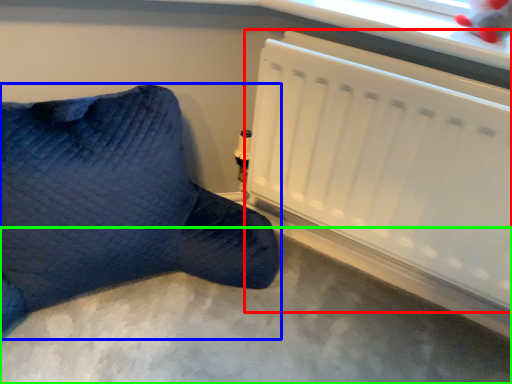
Question: Considering the real-world distances, which object is farthest from radiator (highlighted by a red box)? furniture (highlighted by a blue box) or concrete (highlighted by a green box)?

Choices:
 (A) furniture
 (B) concrete

Answer: (B)